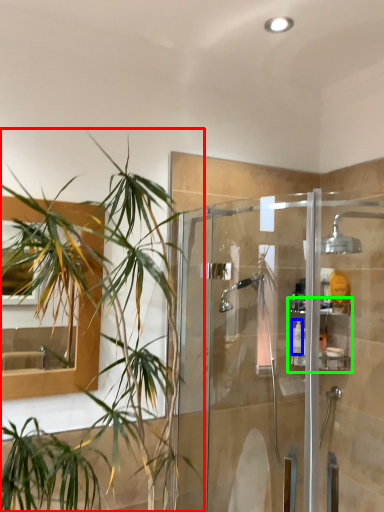
Question: Which object is positioned farthest from houseplant (highlighted by a red box)? Select from toiletry (highlighted by a blue box) and shelf (highlighted by a green box).

Choices:
 (A) toiletry
 (B) shelf

Answer: (A)